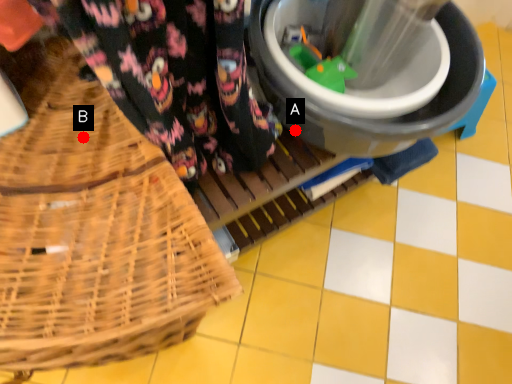
Question: Two points are circled on the image, labeled by A and B beside each circle. Among these points, which one is farthest from the camera?

Choices:
 (A) A is further
 (B) B is further

Answer: (A)